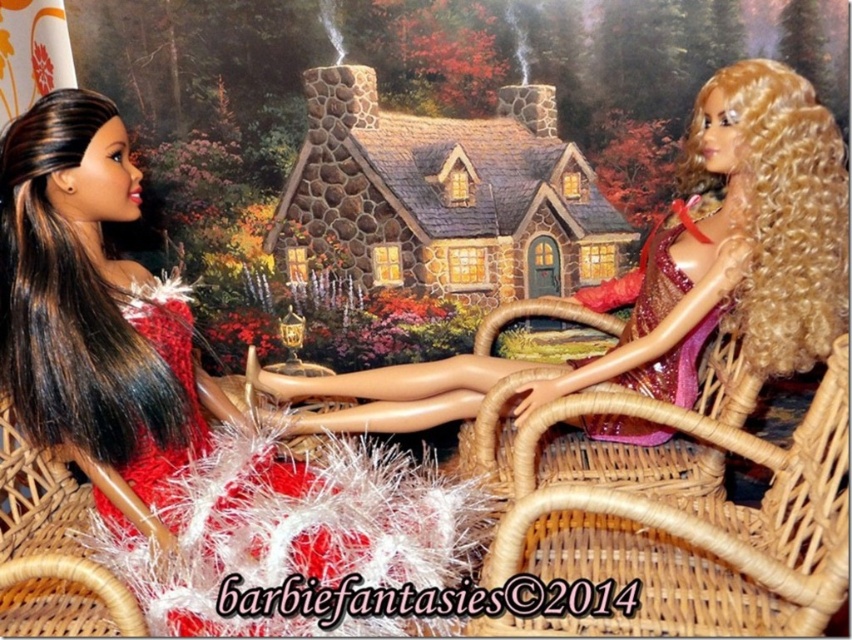
Measure the distance between shiny pink fabric at center and woven wicker chair at center.

They are 11.03 inches apart.

Does shiny pink fabric at center have a smaller size compared to woven wicker chair at center?

No.

Describe the element at coordinates (737, 244) in the screenshot. The image size is (852, 640). I see `shiny pink fabric at center` at that location.

This screenshot has height=640, width=852. I want to click on shiny pink fabric at center, so click(x=737, y=244).

Which is in front, point (114, 502) or point (790, 248)?

Point (114, 502)

You are a GUI agent. You are given a task and a screenshot of the screen. Output one action in this format:
    pyautogui.click(x=<x>, y=<y>)
    Task: Click on the shiny red dress at left
    The width and height of the screenshot is (852, 640).
    Given the screenshot: What is the action you would take?
    pyautogui.click(x=180, y=403)

Can you confirm if woven wicker chair at center is positioned above shiny pink fabric dress at right?

Actually, woven wicker chair at center is below shiny pink fabric dress at right.

From the picture: Measure the distance between woven wicker chair at center and shiny pink fabric dress at right.

The distance of woven wicker chair at center from shiny pink fabric dress at right is 12.14 inches.

Find the location of a particular element. The image size is (852, 640). woven wicker chair at center is located at coordinates (688, 528).